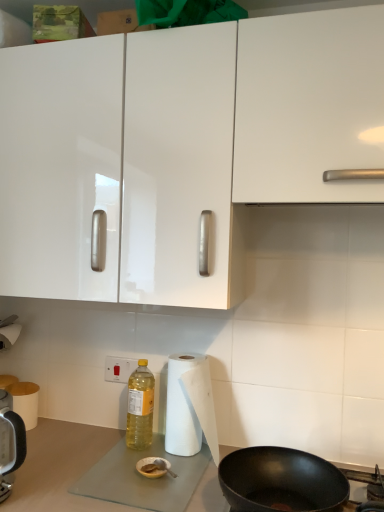
The image size is (384, 512). I want to click on vacant area that is in front of yellow translucent bottle at lower center, so click(x=138, y=468).